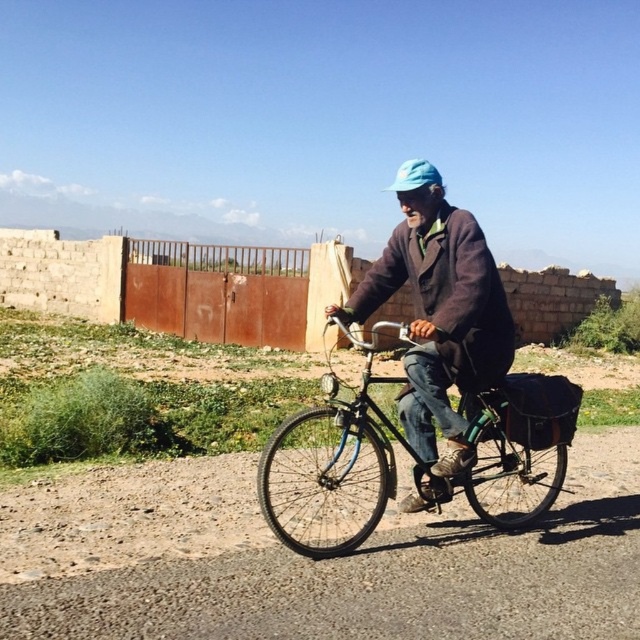
You are a photographer trying to capture the dark brown woolen jacket at center in the image. The jacket is positioned at point (440, 324). If you want to focus on this jacket, where should you aim your camera?

The dark brown woolen jacket at center is located at point (440, 324), so you should aim your camera at that coordinate to focus on it.

You are a fashion designer observing a person riding a bicycle. You notice the dark brown woolen jacket at center and the blue fabric hat at center. Which of these two items takes up more visual space in the image?

The blue fabric hat at center takes up more visual space than the dark brown woolen jacket at center because the dark brown woolen jacket at center occupies less space than blue fabric hat at center.

You are a photographer wanting to capture the blue metallic bicycle at center and the dark brown woolen jacket at center in a single shot. Since you want both objects to be clearly visible, which object should you focus on first to ensure proper depth of field?

The blue metallic bicycle at center is shorter than dark brown woolen jacket at center, so you should focus on the dark brown woolen jacket at center first to ensure both are in focus.